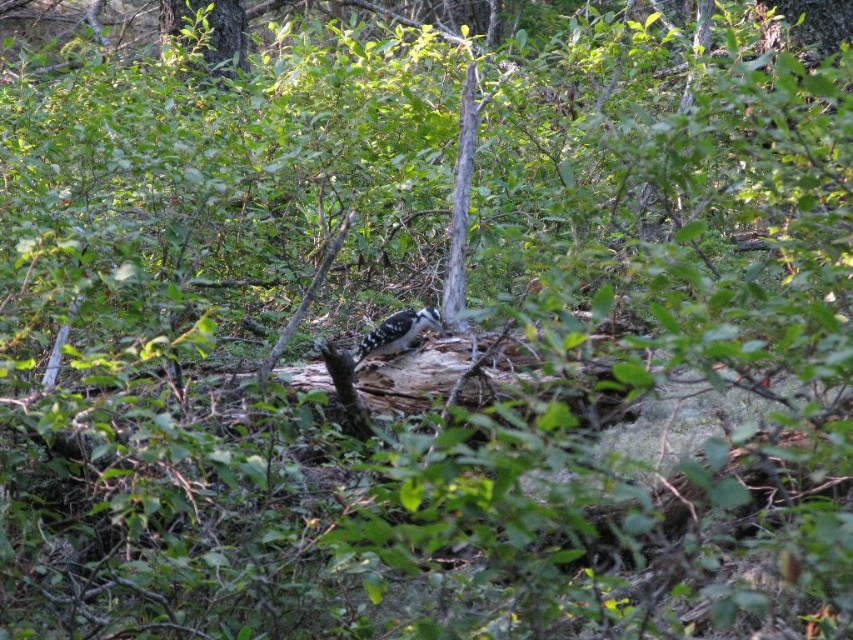
Question: Which object appears closest to the camera in this image?

Choices:
 (A) speckled brown woodpecker at center
 (B) green leafy tree at upper center

Answer: (A)

Question: Can you confirm if green leafy tree at upper center is positioned below speckled brown woodpecker at center?

Choices:
 (A) yes
 (B) no

Answer: (B)

Question: Which of the following is the closest to the observer?

Choices:
 (A) speckled brown woodpecker at center
 (B) green leafy tree at upper center

Answer: (A)

Question: Is green leafy tree at upper center behind speckled brown woodpecker at center?

Choices:
 (A) no
 (B) yes

Answer: (B)

Question: Is green leafy tree at upper center to the right of speckled brown woodpecker at center from the viewer's perspective?

Choices:
 (A) yes
 (B) no

Answer: (B)

Question: Which object is farther from the camera taking this photo?

Choices:
 (A) speckled brown woodpecker at center
 (B) green leafy tree at upper center

Answer: (B)